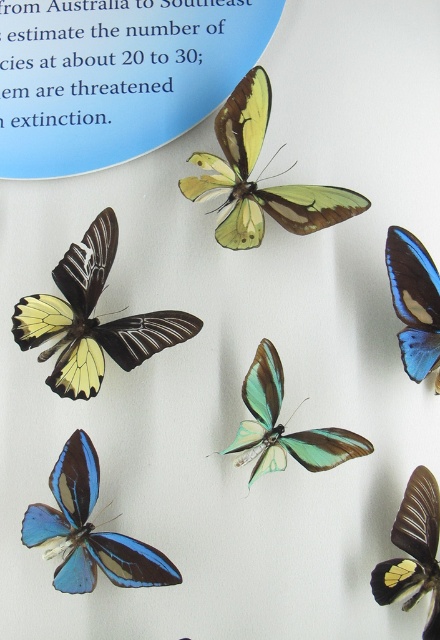
Can you confirm if blue translucent butterfly at lower left is positioned to the right of blue glossy butterfly at upper right?

In fact, blue translucent butterfly at lower left is to the left of blue glossy butterfly at upper right.

Who is more forward, (47, 531) or (431, 337)?

Point (47, 531)

Where is `blue translucent butterfly at lower left`? Image resolution: width=440 pixels, height=640 pixels. blue translucent butterfly at lower left is located at coordinates (88, 531).

Is blue translucent butterfly at lower left bigger than matte black butterfly at upper right?

Indeed, blue translucent butterfly at lower left has a larger size compared to matte black butterfly at upper right.

Is blue translucent butterfly at lower left behind matte black butterfly at upper right?

Yes.

The width and height of the screenshot is (440, 640). Describe the element at coordinates (88, 531) in the screenshot. I see `blue translucent butterfly at lower left` at that location.

Find the location of a particular element. The image size is (440, 640). blue translucent butterfly at lower left is located at coordinates (88, 531).

Is point (80, 248) closer to viewer compared to point (425, 572)?

No.

Can you confirm if matte yellow butterfly at left is positioned above matte black butterfly at upper right?

Yes, matte yellow butterfly at left is above matte black butterfly at upper right.

Between point (36, 324) and point (425, 580), which one is positioned behind?

The point (36, 324) is more distant.

At what (x,y) coordinates should I click in order to perform the action: click on matte yellow butterfly at left. Please return your answer as a coordinate pair (x, y). This screenshot has width=440, height=640. Looking at the image, I should click on (91, 317).